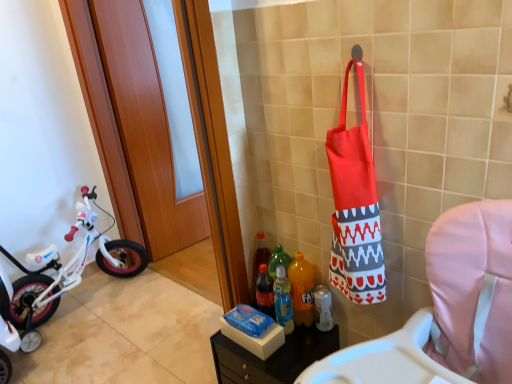
Question: Is red fabric tote bag at right inside orange plastic bottle at center, the second bottle in the right-to-left sequence?

Choices:
 (A) yes
 (B) no

Answer: (B)

Question: Can you confirm if orange plastic bottle at center, the second bottle in the right-to-left sequence, is wider than red fabric tote bag at right?

Choices:
 (A) yes
 (B) no

Answer: (B)

Question: Is orange plastic bottle at center, the second bottle in the right-to-left sequence, to the right of red fabric tote bag at right from the viewer's perspective?

Choices:
 (A) yes
 (B) no

Answer: (B)

Question: Considering the relative sizes of orange plastic bottle at center, the second bottle in the left-to-right sequence, and red fabric tote bag at right in the image provided, is orange plastic bottle at center, the second bottle in the left-to-right sequence, thinner than red fabric tote bag at right?

Choices:
 (A) no
 (B) yes

Answer: (B)

Question: Considering the relative positions of orange plastic bottle at center, the second bottle in the right-to-left sequence, and red fabric tote bag at right in the image provided, is orange plastic bottle at center, the second bottle in the right-to-left sequence, behind red fabric tote bag at right?

Choices:
 (A) no
 (B) yes

Answer: (B)

Question: Can you confirm if orange plastic bottle at center, the second bottle in the left-to-right sequence, is shorter than red fabric tote bag at right?

Choices:
 (A) no
 (B) yes

Answer: (B)

Question: Is translucent plastic bottle at lower center, which is the 3th bottle from right to left, at the left side of wooden at left?

Choices:
 (A) no
 (B) yes

Answer: (A)

Question: Is translucent plastic bottle at lower center, acting as the first bottle starting from the left, positioned beyond the bounds of wooden at left?

Choices:
 (A) no
 (B) yes

Answer: (B)

Question: Considering the relative sizes of translucent plastic bottle at lower center, which is the 3th bottle from right to left, and wooden at left in the image provided, is translucent plastic bottle at lower center, which is the 3th bottle from right to left, wider than wooden at left?

Choices:
 (A) yes
 (B) no

Answer: (A)

Question: Could you tell me if translucent plastic bottle at lower center, which is the 3th bottle from right to left, is turned towards wooden at left?

Choices:
 (A) no
 (B) yes

Answer: (A)

Question: Is the position of translucent plastic bottle at lower center, which is the 3th bottle from right to left, more distant than that of wooden at left?

Choices:
 (A) yes
 (B) no

Answer: (B)

Question: Can you confirm if translucent plastic bottle at lower center, which is the 3th bottle from right to left, is thinner than wooden at left?

Choices:
 (A) yes
 (B) no

Answer: (B)

Question: Does translucent plastic bottle at lower center, which is the 3th bottle from right to left, have a greater height compared to red fabric tote bag at right?

Choices:
 (A) yes
 (B) no

Answer: (B)